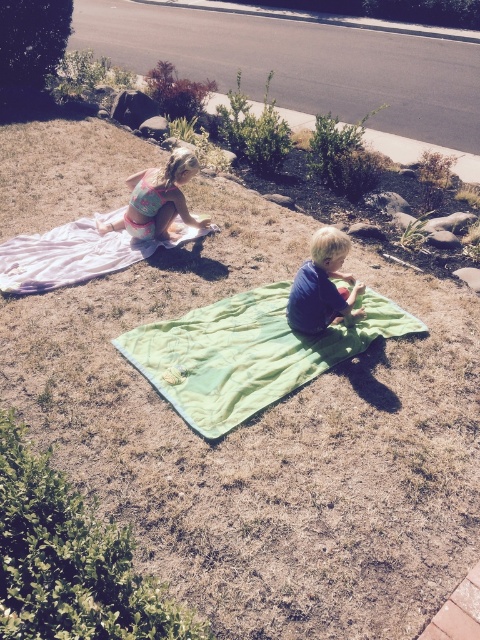
You are standing at the camera position and want to throw a ball to a point that is 4.40 meters away. Is the point at coordinates point [177,326] within this distance?

The distance of point [177,326] from camera is 4.40 meters, so yes, the point is exactly at the desired distance of 4.40 meters, making it suitable for throwing the ball.

You are a photographer trying to capture a closeup of the pink fabric blanket at upper left and the matte pink swimsuit at upper left. Since you want to focus on the blanket, which object should you adjust your camera to prioritize in terms of size?

The pink fabric blanket at upper left is larger in size than the matte pink swimsuit at upper left, so you should prioritize focusing on the pink fabric blanket at upper left as it is bigger and more prominent in the frame.